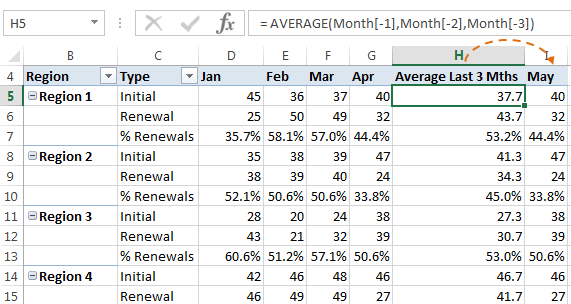
You are a GUI agent. You are given a task and a screenshot of the screen. Output one action in this format:
    pyautogui.click(x=<x>, y=<y>)
    Task: Click on the column
    
    Given the screenshot: What is the action you would take?
    pyautogui.click(x=75, y=53), pyautogui.click(x=152, y=52), pyautogui.click(x=226, y=54), pyautogui.click(x=287, y=53), pyautogui.click(x=321, y=54), pyautogui.click(x=375, y=54), pyautogui.click(x=447, y=56), pyautogui.click(x=549, y=54)